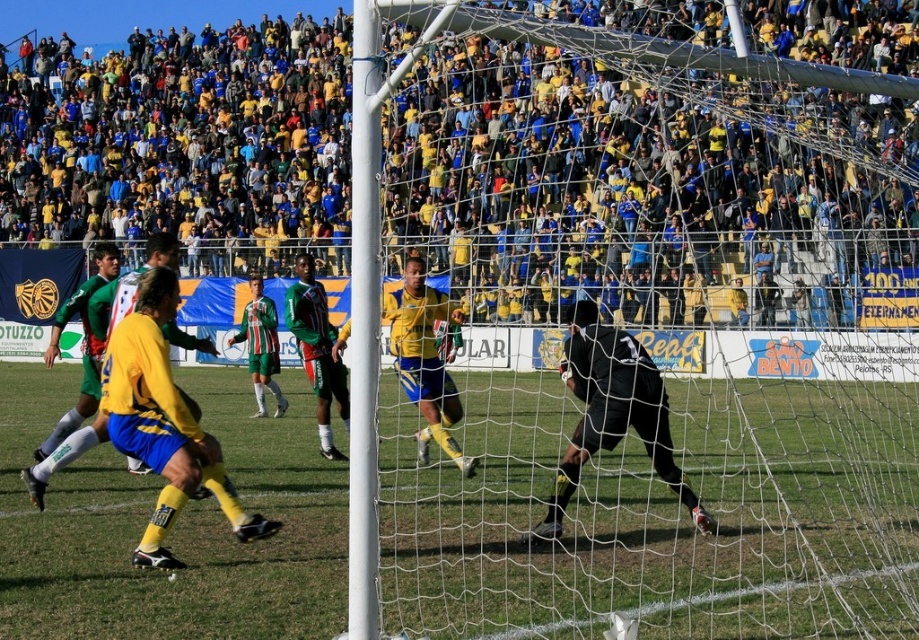
Question: Which of the following is the farthest from the observer?

Choices:
 (A) green grass football field at center
 (B) black matte/goalkeeper at center
 (C) yellow/yellowish fabric at upper center

Answer: (B)

Question: Does green striped jersey at center have a lesser width compared to green grass football field at center?

Choices:
 (A) no
 (B) yes

Answer: (B)

Question: Can you confirm if yellow/yellowish fabric at upper center is positioned to the right of green striped jersey at center?

Choices:
 (A) yes
 (B) no

Answer: (B)

Question: Estimate the real-world distances between objects in this image. Which object is farther from the yellow/yellowish fabric at upper center?

Choices:
 (A) green grass football field at center
 (B) green striped jersey at center

Answer: (B)

Question: Estimate the real-world distances between objects in this image. Which object is closer to the yellow/yellowish fabric at upper center?

Choices:
 (A) green grass football field at center
 (B) green striped jersey at center

Answer: (A)

Question: Can you confirm if green striped jersey at center is wider than green grass football field at center?

Choices:
 (A) no
 (B) yes

Answer: (A)